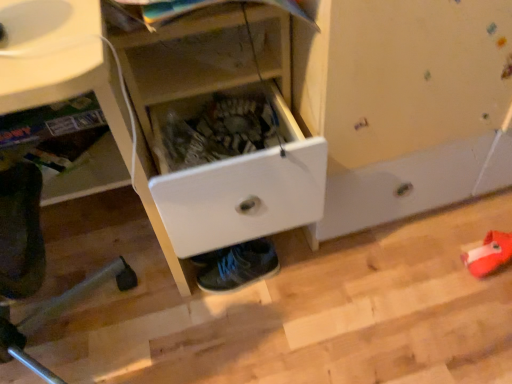
This screenshot has height=384, width=512. I want to click on free location to the right of shiny blue sneakers at lower center, so click(306, 274).